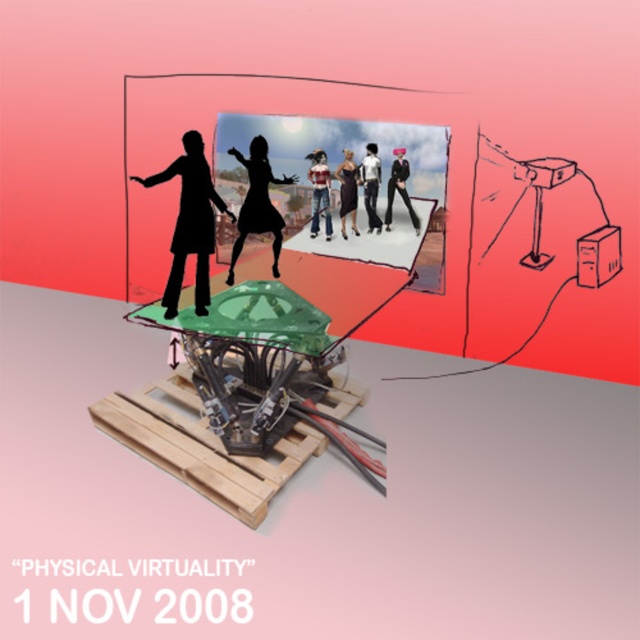
Question: Can you confirm if denim jeans at center is positioned below black leather jacket at center?

Choices:
 (A) yes
 (B) no

Answer: (B)

Question: From the image, what is the correct spatial relationship of denim jeans at center in relation to matte black shirt at center?

Choices:
 (A) above
 (B) below

Answer: (B)

Question: Among these points, which one is nearest to the camera?

Choices:
 (A) (230, 280)
 (B) (364, 157)
 (C) (198, 294)

Answer: (C)

Question: In this image, where is black matte figure at center located relative to black matte dress at center?

Choices:
 (A) left
 (B) right

Answer: (A)

Question: Among these points, which one is nearest to the camera?

Choices:
 (A) (353, 164)
 (B) (276, 252)
 (C) (257, 230)

Answer: (C)

Question: Estimate the real-world distances between objects in this image. Which object is closer to the black leather jacket at center?

Choices:
 (A) black glossy dress at center
 (B) denim jeans at center
 (C) matte black shirt at center
 (D) black matte dress at center

Answer: (C)